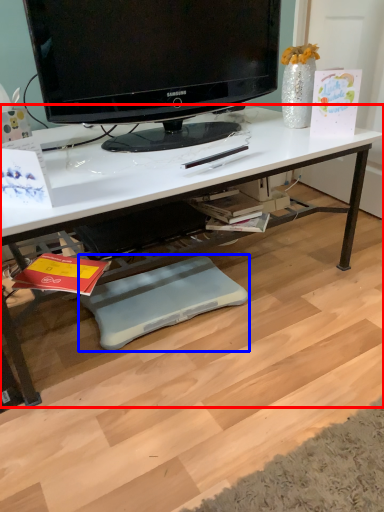
Question: Which object appears closest to the camera in this image, desk (highlighted by a red box) or footrest (highlighted by a blue box)?

Choices:
 (A) desk
 (B) footrest

Answer: (A)